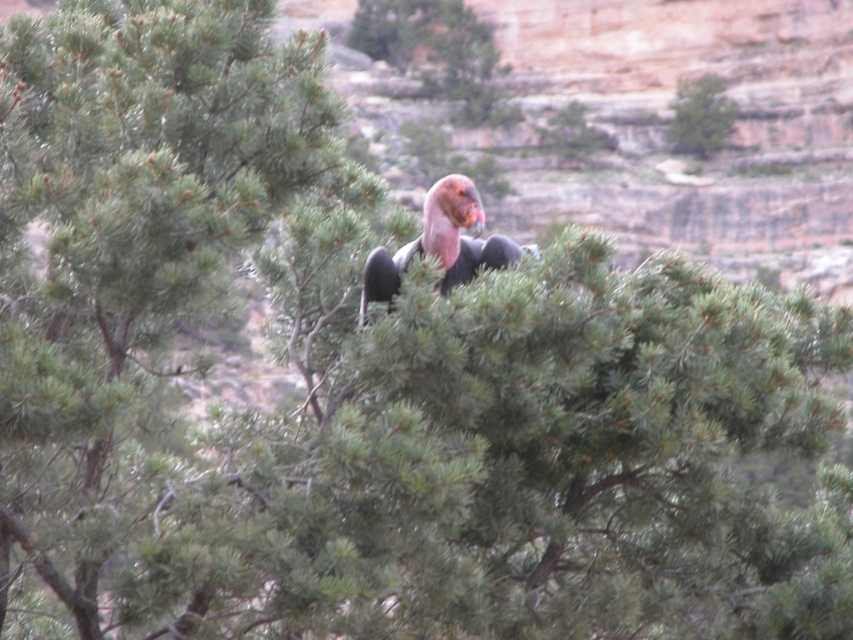
Which is more to the left, pink feathered bird at center or green matte tree at upper center?

pink feathered bird at center

Which is behind, point (456, 241) or point (714, 77)?

Point (714, 77)

The width and height of the screenshot is (853, 640). Identify the location of pink feathered bird at center. (440, 243).